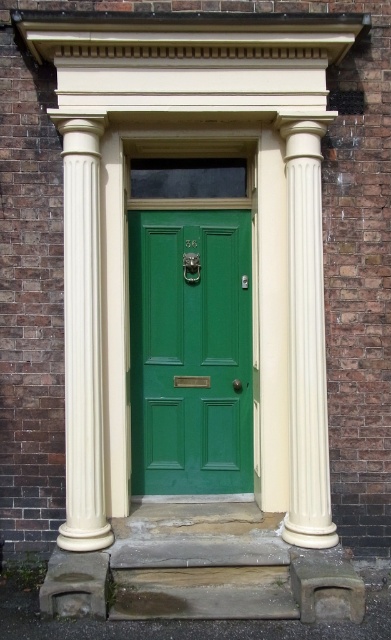
You are standing in front of the entrance described in the scene. Where exactly is the green matte door at center located in terms of coordinates?

The green matte door at center is located at point coordinates of (190, 352).

You are standing in front of the entrance and want to locate the creamy smooth column at left. What is its 2D coordinate position?

The creamy smooth column at left is located at the 2D coordinate position of point [82,337].

Consider the image. You are a painter who needs to decide whether to bring a ladder or a step stool to paint the green matte door at center and the creamy smooth column at right. The ladder can handle heights up to 2 meters, while the step stool only goes up to 1 meter. Based on their heights, which tool should you choose?

The green matte door at center is taller than the creamy smooth column at right, so you should bring the ladder since it can reach up to 2 meters, which is necessary for painting the taller green matte door at center.